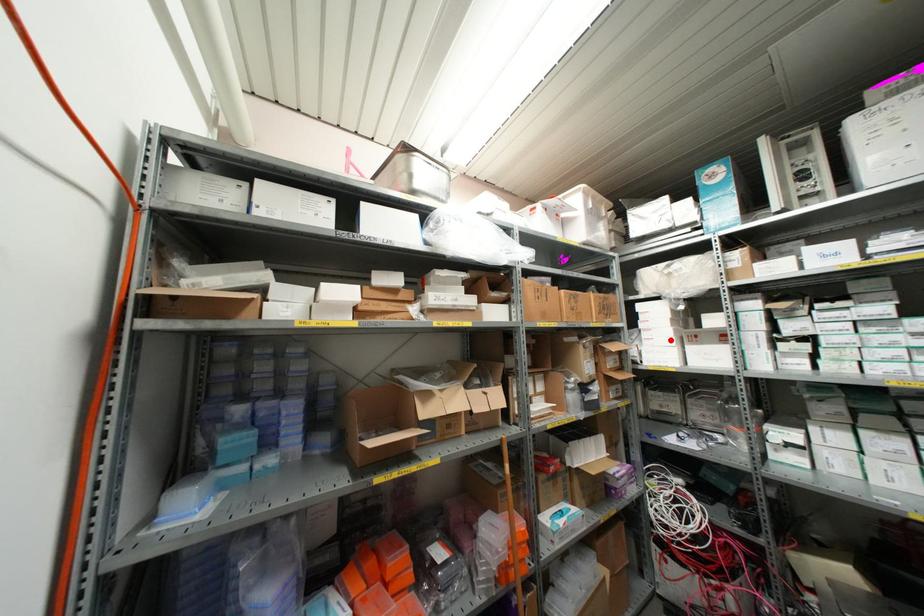
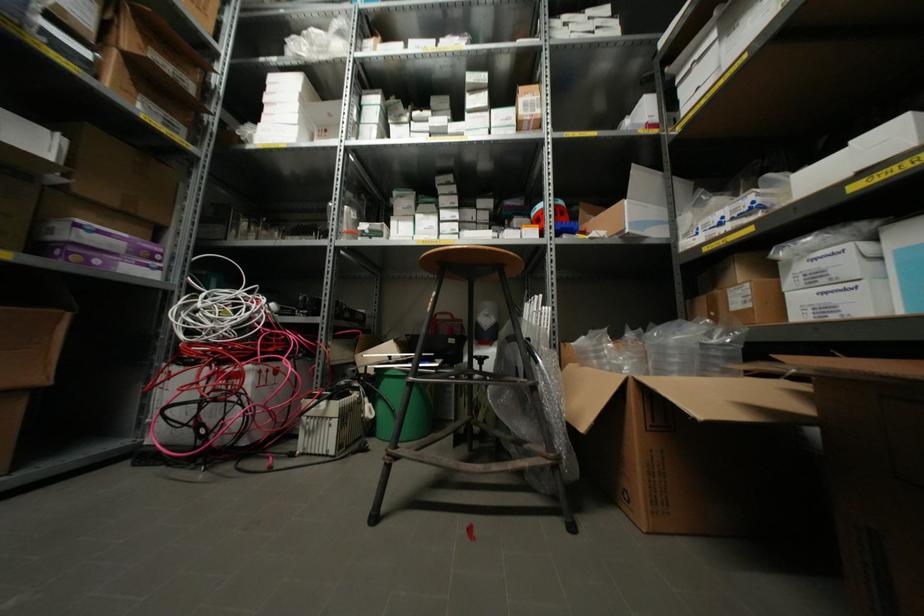
Locate, in the second image, the point that corresponds to the highlighted location in the first image.

(293, 116)